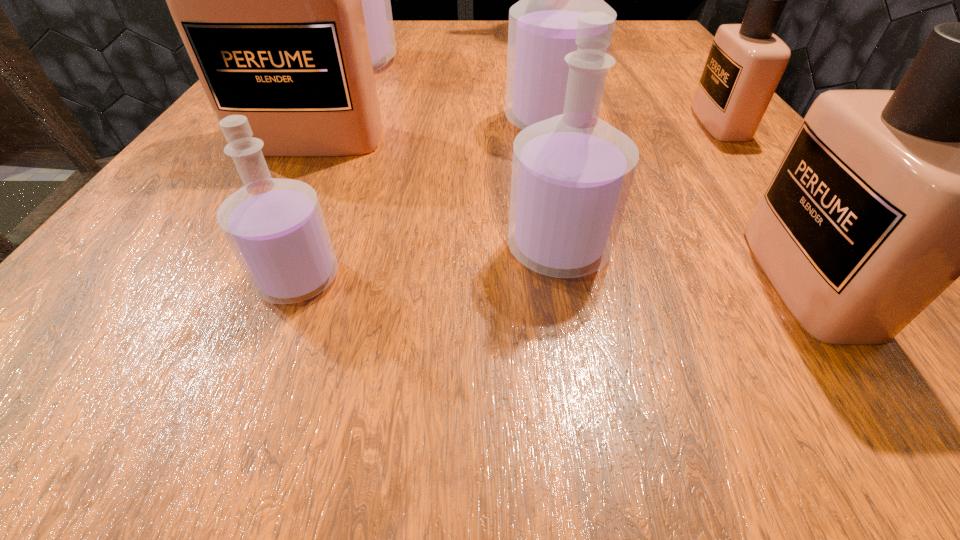
Locate an element on the screen. Image resolution: width=960 pixels, height=540 pixels. red fire extinguisher is located at coordinates (603, 0).

Find the location of a particular element. This screenshot has width=960, height=540. fire extinguisher is located at coordinates (603, 0).

Find the location of `the seventh shortest object`. the seventh shortest object is located at coordinates (376, 3).

Image resolution: width=960 pixels, height=540 pixels. I want to click on the farthest perfume, so click(376, 3).

Find the location of `the third smallest purple perfume`. the third smallest purple perfume is located at coordinates (542, 29).

The height and width of the screenshot is (540, 960). I want to click on the leftmost beige perfume, so click(267, 0).

Find the location of a particular element. the second smallest purple perfume is located at coordinates (571, 174).

Locate an element on the screen. The width and height of the screenshot is (960, 540). the second smallest beige perfume is located at coordinates (884, 198).

This screenshot has width=960, height=540. Find the location of `the smallest beige perfume`. the smallest beige perfume is located at coordinates (746, 61).

Locate an element on the screen. This screenshot has width=960, height=540. the smallest purple perfume is located at coordinates (276, 229).